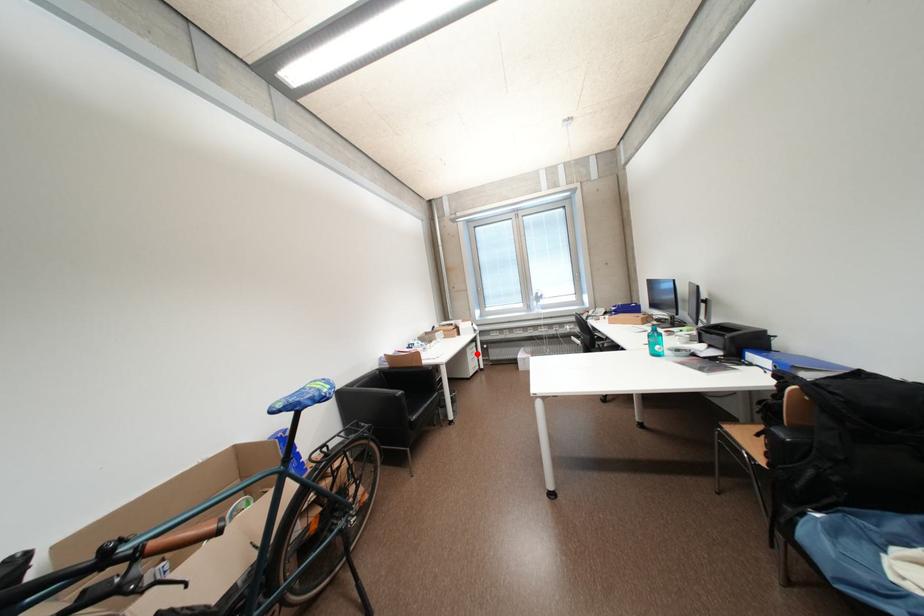
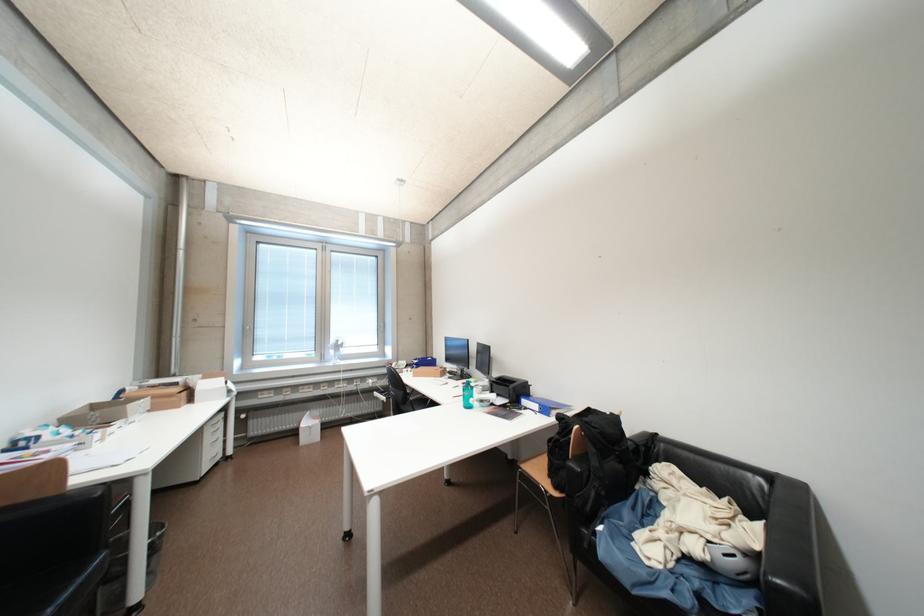
Question: I am providing you with two images of the same scene from different viewpoints. In image1, a red point is highlighted. Considering the same 3D point in image2, which of the following is correct?

Choices:
 (A) It is closer
 (B) It is farther

Answer: (A)